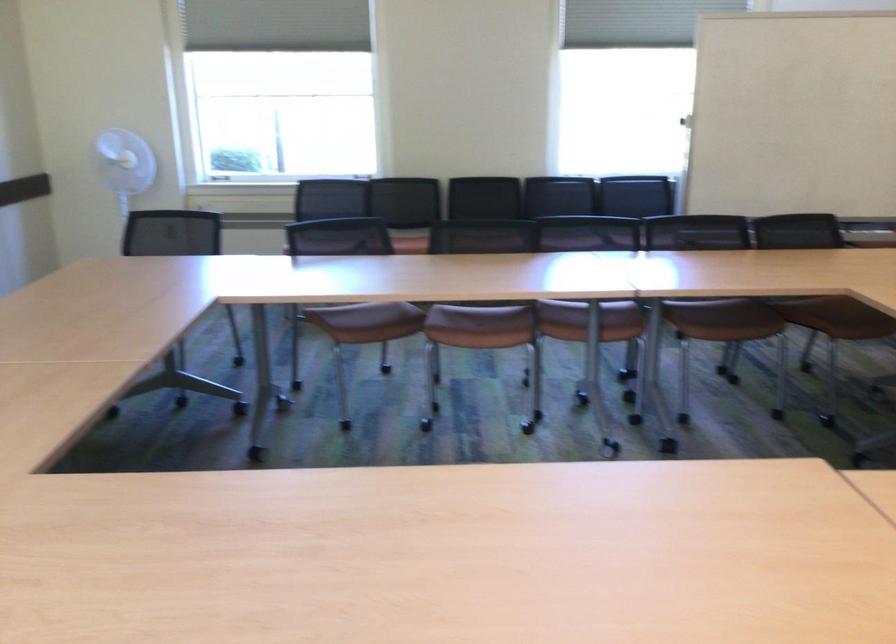
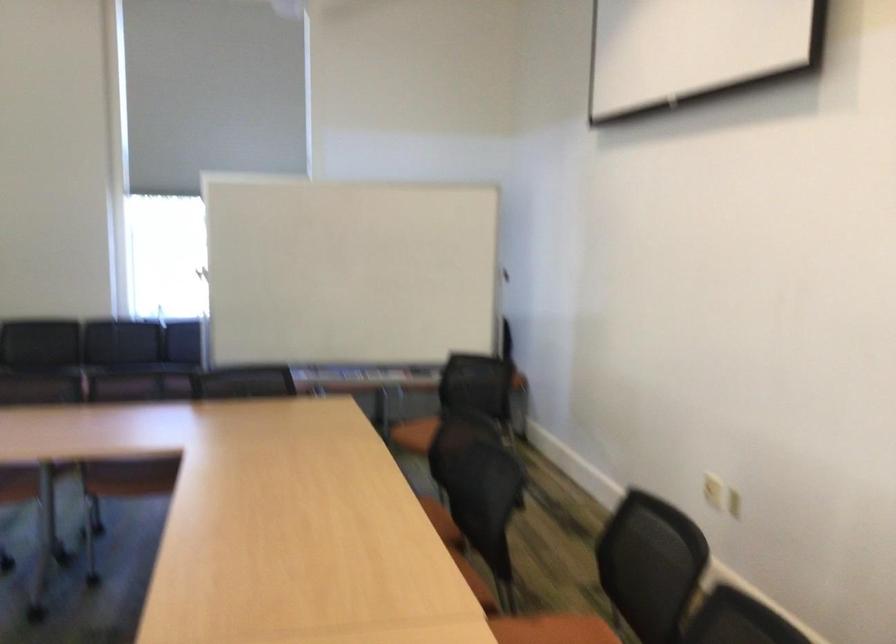
Question: In a continuous first-person perspective shot, in which direction is the camera moving?

Choices:
 (A) Left
 (B) Right
 (C) Forward
 (D) Backward

Answer: (B)